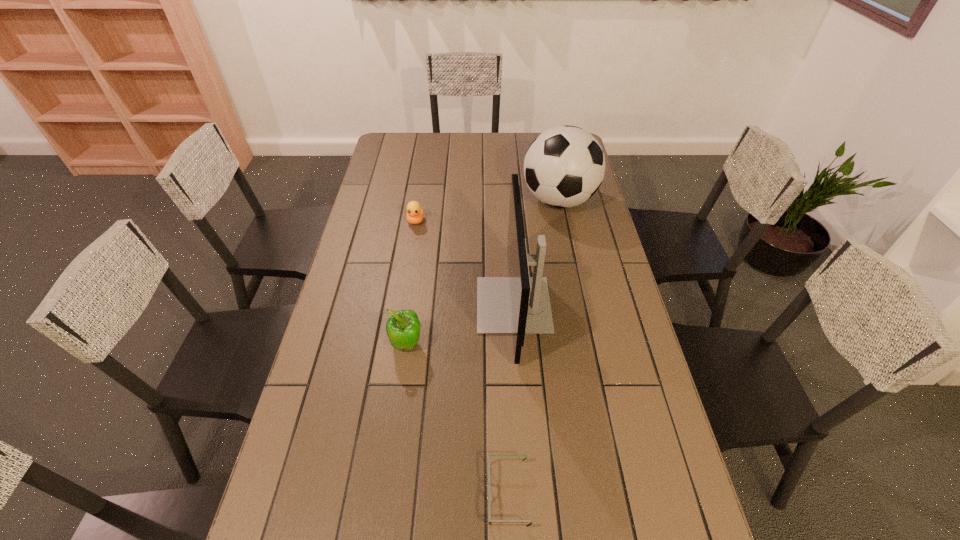
Locate an element on the screen. free space between the bell pepper and the computer monitor is located at coordinates (461, 325).

This screenshot has height=540, width=960. Find the location of `free space between the fourth tallest object and the third shortest object`. free space between the fourth tallest object and the third shortest object is located at coordinates (412, 282).

Locate an element on the screen. The image size is (960, 540). vacant space in between the third tallest object and the computer monitor is located at coordinates (461, 325).

Where is `free spot between the spectacles and the soccer ball`? The height and width of the screenshot is (540, 960). free spot between the spectacles and the soccer ball is located at coordinates (534, 347).

The height and width of the screenshot is (540, 960). What are the coordinates of `vacant region between the fourth tallest object and the nearest object` in the screenshot? It's located at (462, 357).

Where is `free point between the soccer ball and the bell pepper`? free point between the soccer ball and the bell pepper is located at coordinates (483, 272).

The width and height of the screenshot is (960, 540). Find the location of `vacant space in between the soccer ball and the nearest object`. vacant space in between the soccer ball and the nearest object is located at coordinates [x=534, y=347].

I want to click on empty space between the nearest object and the third tallest object, so click(x=458, y=419).

Locate an element on the screen. This screenshot has width=960, height=540. free spot between the duckling and the spectacles is located at coordinates (462, 357).

Locate which object ranks third in proximity to the computer monitor. Please provide its 2D coordinates. Your answer should be formatted as a tuple, i.e. [(x, y)], where the tuple contains the x and y coordinates of a point satisfying the conditions above.

[(415, 214)]